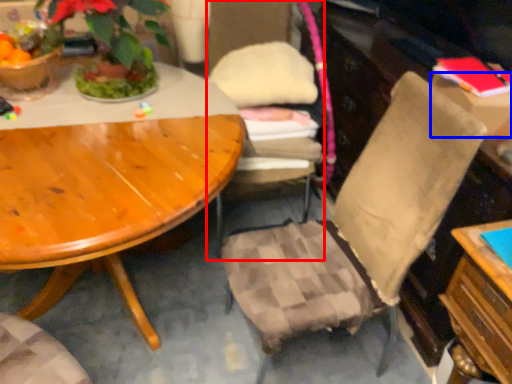
Question: Which of the following is the closest to the observer, chair (highlighted by a red box) or box (highlighted by a blue box)?

Choices:
 (A) chair
 (B) box

Answer: (B)